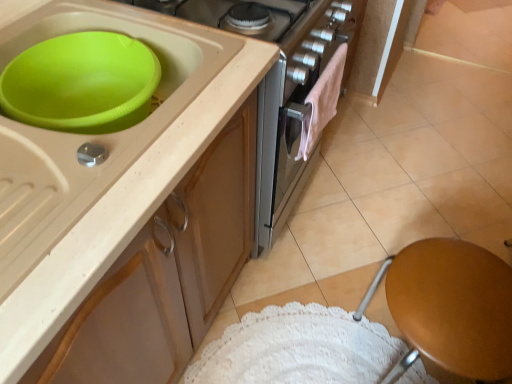
Question: Is beige matte tile at upper right with matte beige cabinet at upper left?

Choices:
 (A) no
 (B) yes

Answer: (A)

Question: Could you tell me if beige matte tile at upper right is facing matte beige cabinet at upper left?

Choices:
 (A) no
 (B) yes

Answer: (A)

Question: Does beige matte tile at upper right have a smaller size compared to matte beige cabinet at upper left?

Choices:
 (A) yes
 (B) no

Answer: (A)

Question: Is beige matte tile at upper right outside of matte beige cabinet at upper left?

Choices:
 (A) yes
 (B) no

Answer: (A)

Question: Can you confirm if beige matte tile at upper right is wider than matte beige cabinet at upper left?

Choices:
 (A) no
 (B) yes

Answer: (B)

Question: Is beige matte tile at upper right shorter than matte beige cabinet at upper left?

Choices:
 (A) yes
 (B) no

Answer: (A)

Question: Is brown wooden stool at lower right positioned behind pink fluffy towel at center?

Choices:
 (A) no
 (B) yes

Answer: (A)

Question: From the image's perspective, is brown wooden stool at lower right located beneath pink fluffy towel at center?

Choices:
 (A) no
 (B) yes

Answer: (B)

Question: Could you tell me if brown wooden stool at lower right is turned towards pink fluffy towel at center?

Choices:
 (A) yes
 (B) no

Answer: (B)

Question: From a real-world perspective, is brown wooden stool at lower right beneath pink fluffy towel at center?

Choices:
 (A) yes
 (B) no

Answer: (A)

Question: Considering the relative sizes of brown wooden stool at lower right and pink fluffy towel at center in the image provided, is brown wooden stool at lower right thinner than pink fluffy towel at center?

Choices:
 (A) no
 (B) yes

Answer: (A)

Question: Is brown wooden stool at lower right taller than pink fluffy towel at center?

Choices:
 (A) no
 (B) yes

Answer: (B)

Question: Can you confirm if pink fluffy towel at center is bigger than beige matte tile at upper right?

Choices:
 (A) no
 (B) yes

Answer: (A)